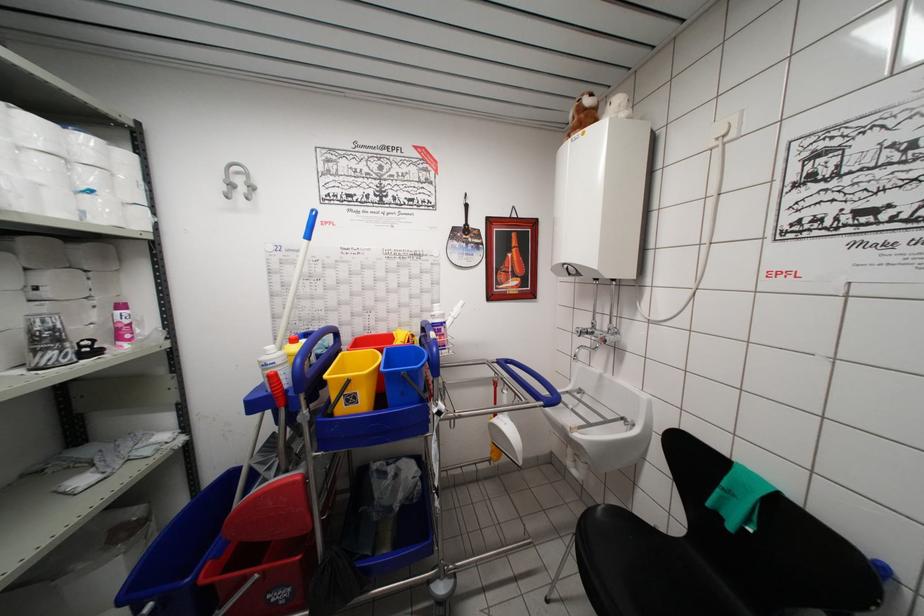
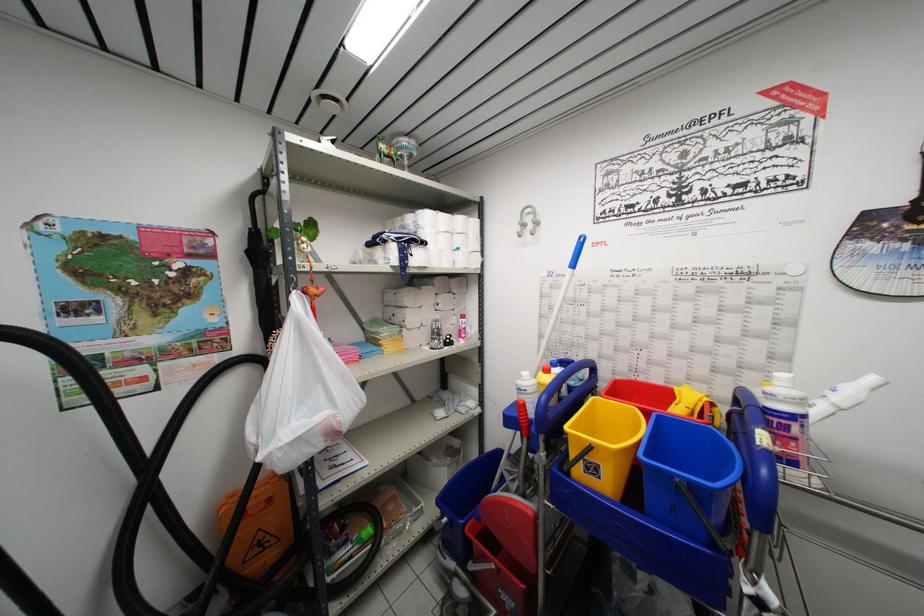
Find the pixel in the second image that matches [250,179] in the first image.

(537, 217)